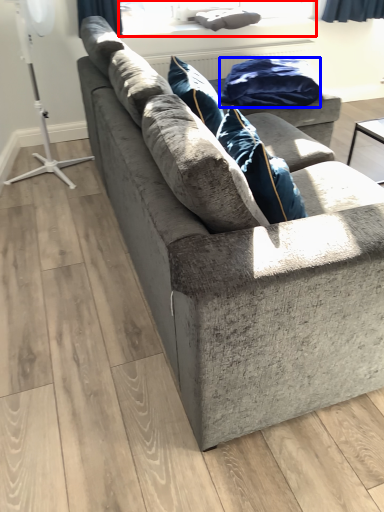
Question: Which point is further to the camera, window screen (highlighted by a red box) or material (highlighted by a blue box)?

Choices:
 (A) window screen
 (B) material

Answer: (A)